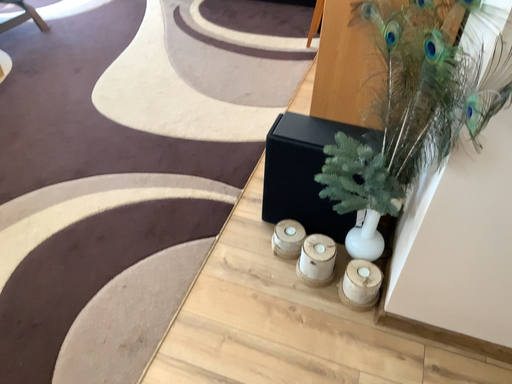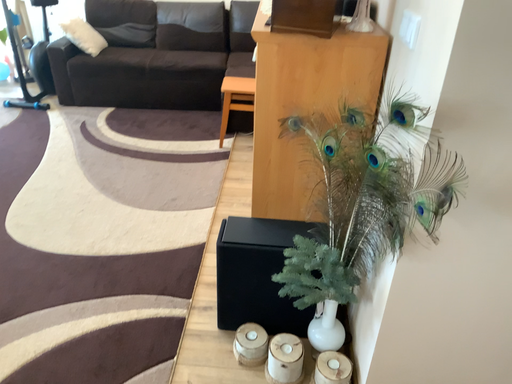
Question: Which way did the camera rotate in the video?

Choices:
 (A) rotated upward
 (B) rotated downward

Answer: (A)